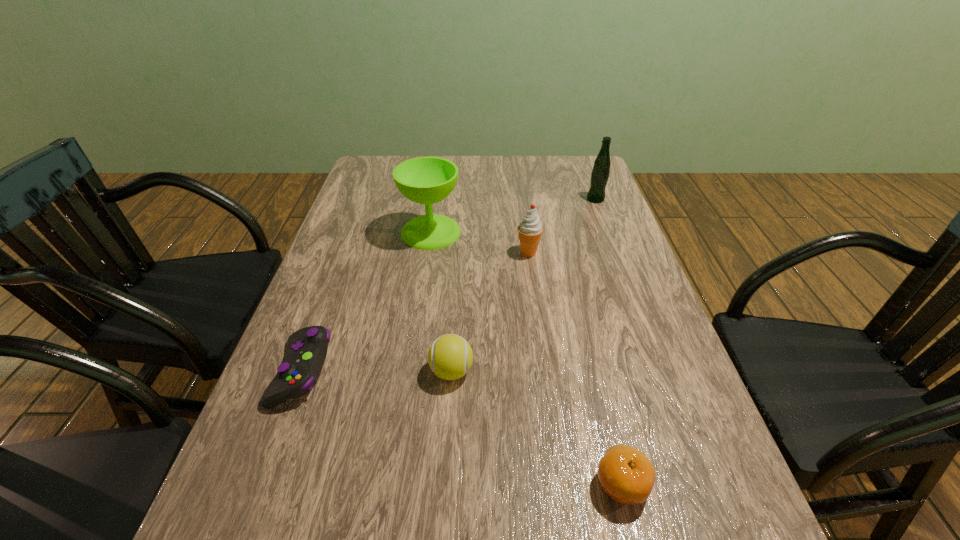
At what (x,y) coordinates should I click in order to perform the action: click on vacant space at the right edge. Please return your answer as a coordinate pair (x, y). The image size is (960, 540). Looking at the image, I should click on (633, 263).

Where is `vacant space at the far right corner of the desktop`? This screenshot has width=960, height=540. vacant space at the far right corner of the desktop is located at coordinates (595, 158).

Locate an element on the screen. free space between the wineglass and the tennis ball is located at coordinates (442, 301).

This screenshot has width=960, height=540. Identify the location of free spot between the leftmost object and the clementine. (462, 427).

At what (x,y) coordinates should I click in order to perform the action: click on empty location between the fourth tallest object and the control. Please return your answer as a coordinate pair (x, y). This screenshot has width=960, height=540. Looking at the image, I should click on (377, 371).

Where is `unoccupied area between the wineglass and the clementine`? This screenshot has height=540, width=960. unoccupied area between the wineglass and the clementine is located at coordinates (526, 358).

The height and width of the screenshot is (540, 960). In order to click on vacant area that lies between the fourth tallest object and the leftmost object in this screenshot , I will do `click(377, 371)`.

Locate an element on the screen. The width and height of the screenshot is (960, 540). free space between the control and the clementine is located at coordinates (462, 427).

Where is `vacant space that's between the fifth object from left to right and the leftmost object`? vacant space that's between the fifth object from left to right and the leftmost object is located at coordinates (462, 427).

Find the location of a particular element. free space that is in between the rightmost object and the nearest object is located at coordinates (609, 341).